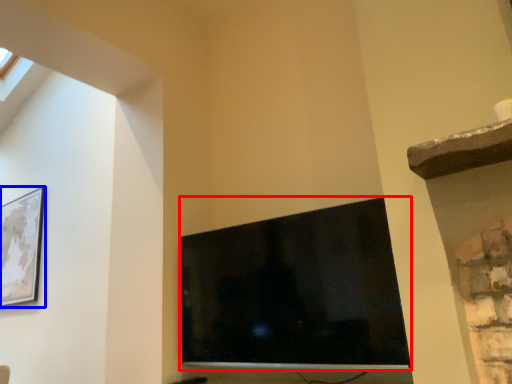
Question: Which object is closer to the camera taking this photo, television (highlighted by a red box) or picture frame (highlighted by a blue box)?

Choices:
 (A) television
 (B) picture frame

Answer: (A)